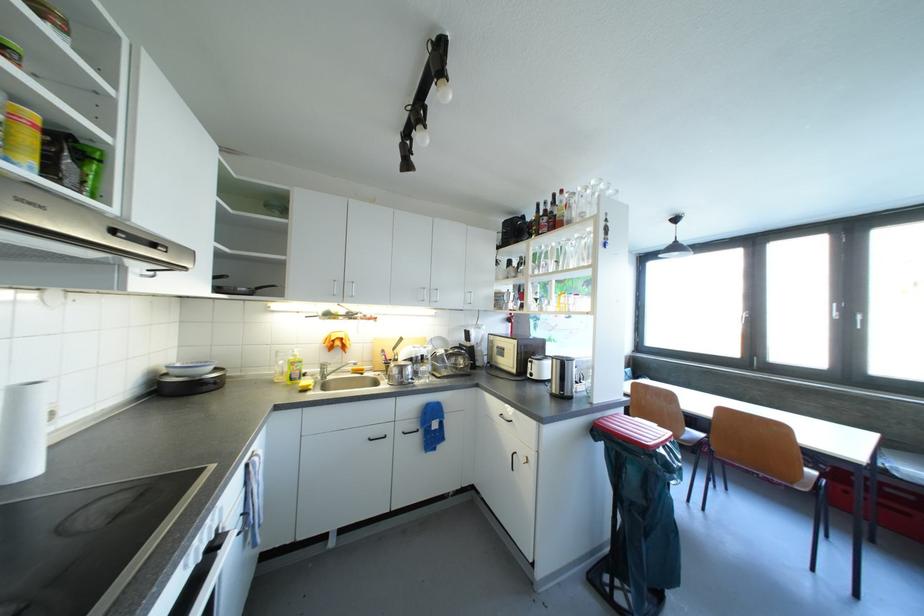
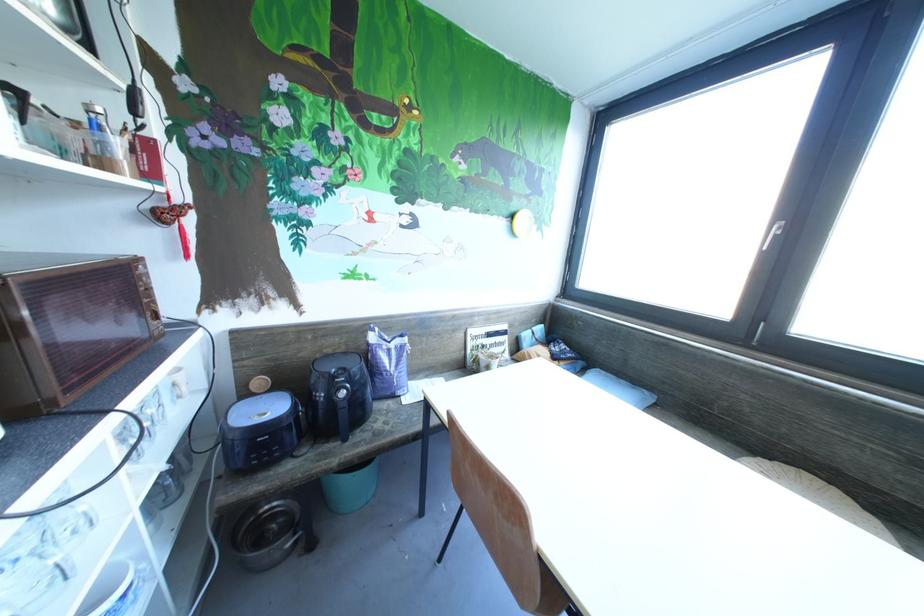
The images are taken continuously from a first-person perspective. In which direction are you moving?

The cameraman walked toward right, forward.